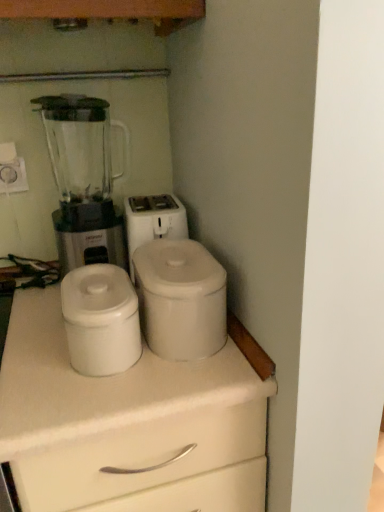
At what (x,y) coordinates should I click in order to perform the action: click on vacant region in front of white matte container at center, which is the first appliance from left to right. Please return your answer as a coordinate pair (x, y). Looking at the image, I should click on click(x=87, y=397).